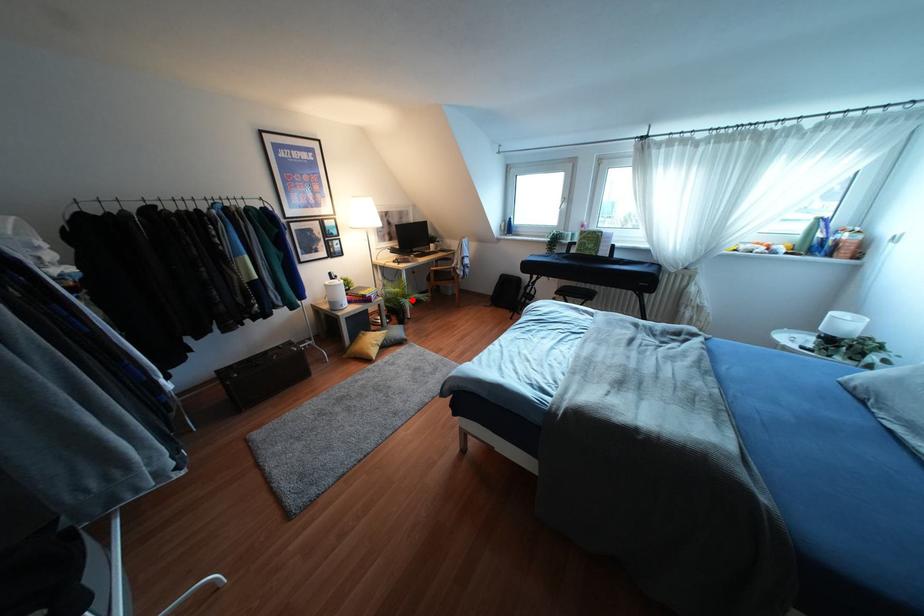
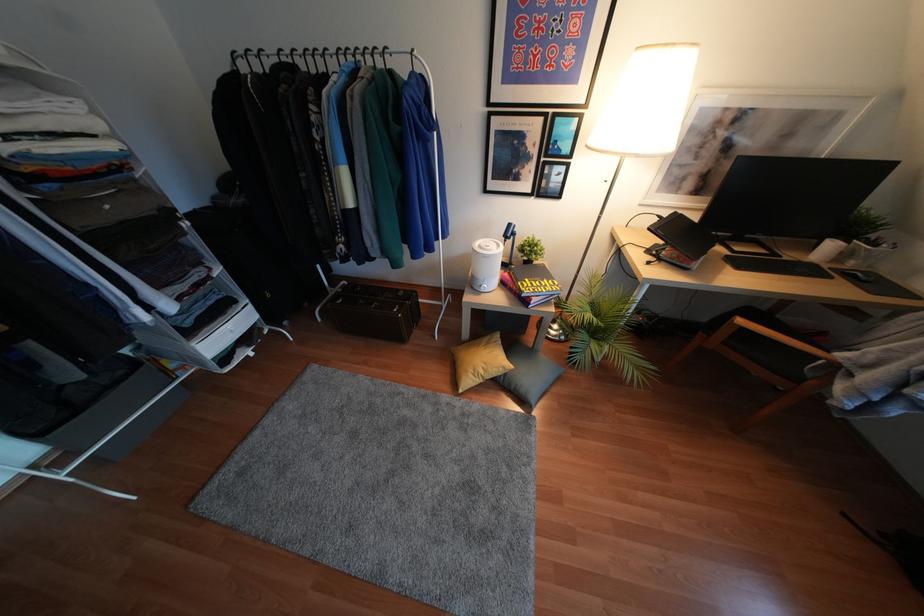
Question: I am providing you with two images of the same scene from different viewpoints. In image1, a red point is highlighted. Considering the same 3D point in image2, which of the following is correct?

Choices:
 (A) It is closer
 (B) It is farther

Answer: (A)